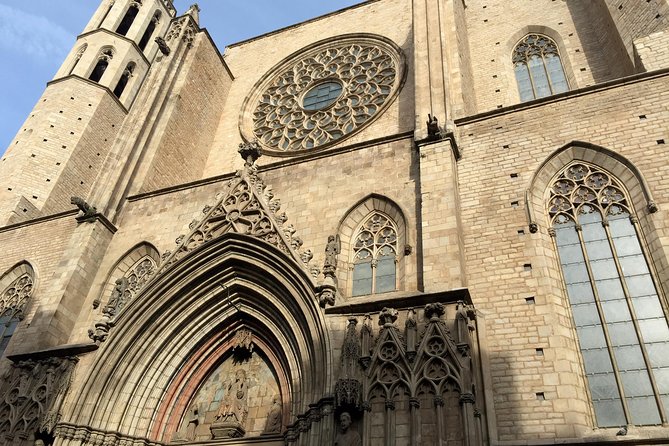
I want to click on 3rd window on second level, so click(377, 264).